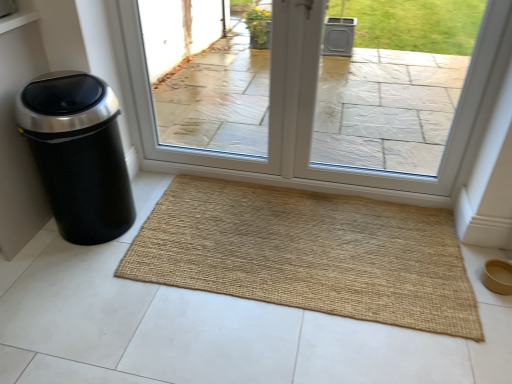
Where is `natural fiber mat at center`? The image size is (512, 384). natural fiber mat at center is located at coordinates (308, 253).

In order to face black matte trash can at left, should I rotate leftwards or rightwards?

Rotate your view left by about 21.879°.

Find the location of a particular element. This screenshot has width=512, height=384. natural fiber mat at center is located at coordinates (308, 253).

Is natural fiber mat at center to the left or to the right of black matte trash can at left in the image?

From the image, it's evident that natural fiber mat at center is to the right of black matte trash can at left.

Is natural fiber mat at center bigger than black matte trash can at left?

No, natural fiber mat at center is not bigger than black matte trash can at left.

How much distance is there between natural fiber mat at center and black matte trash can at left?

25.78 inches.

From a real-world perspective, is natural fiber mat at center above or below black matte trash can at left?

Clearly, from a real-world perspective, natural fiber mat at center is below black matte trash can at left.

Looking at this image, are black matte trash can at left and clear glass door at center far apart?

They are positioned close to each other.

Does point (123, 213) come farther from viewer compared to point (473, 69)?

Yes, point (123, 213) is behind point (473, 69).

From the image's perspective, is black matte trash can at left under clear glass door at center?

Indeed, from the image's perspective, black matte trash can at left is shown beneath clear glass door at center.

Based on their positions, is black matte trash can at left located to the left or right of clear glass door at center?

Based on their positions, black matte trash can at left is located to the left of clear glass door at center.

Looking at this image, from a real-world perspective, is natural fiber mat at center physically below clear glass door at center?

Yes, from a real-world perspective, natural fiber mat at center is below clear glass door at center.

Are natural fiber mat at center and clear glass door at center beside each other?

No, natural fiber mat at center is not making contact with clear glass door at center.

Based on the photo, which point is more forward, (172, 256) or (469, 111)?

Point (172, 256)

What's the angular difference between natural fiber mat at center and clear glass door at center's facing directions?

They differ by 0.579 degrees in their facing directions.

The width and height of the screenshot is (512, 384). Find the location of `window behind the black matte trash can at left`. window behind the black matte trash can at left is located at coordinates coord(314,105).

Can you confirm if clear glass door at center is positioned to the left of black matte trash can at left?

Incorrect, clear glass door at center is not on the left side of black matte trash can at left.

Considering the sizes of clear glass door at center and black matte trash can at left in the image, is clear glass door at center bigger or smaller than black matte trash can at left?

Considering their sizes, clear glass door at center takes up more space than black matte trash can at left.

Which object is further away from the camera taking this photo, clear glass door at center or black matte trash can at left?

clear glass door at center is further from the camera.

Is black matte trash can at left with natural fiber mat at center?

black matte trash can at left is not next to natural fiber mat at center, and they're not touching.

Is black matte trash can at left outside of natural fiber mat at center?

That's correct, black matte trash can at left is outside of natural fiber mat at center.

Which is nearer, (x=79, y=111) or (x=133, y=265)?

The point (x=79, y=111) is closer to the camera.

Could you tell me if clear glass door at center is facing natural fiber mat at center?

Yes.

Considering their positions, is clear glass door at center located in front of or behind natural fiber mat at center?

clear glass door at center is positioned farther from the viewer than natural fiber mat at center.

The width and height of the screenshot is (512, 384). I want to click on mat on the right of the clear glass door at center, so click(x=308, y=253).

Consider the image. From a real-world perspective, between clear glass door at center and natural fiber mat at center, who is vertically lower?

In real-world perspective, natural fiber mat at center is lower.

Identify the location of waste container on the left side of natural fiber mat at center. The image size is (512, 384). (78, 154).

Locate an element on the screen. This screenshot has height=384, width=512. window behind the black matte trash can at left is located at coordinates (314, 105).

Considering their positions, is black matte trash can at left positioned further to clear glass door at center than natural fiber mat at center?

Based on the image, black matte trash can at left appears to be further to clear glass door at center.

Looking at the image, which one is located closer to clear glass door at center, natural fiber mat at center or black matte trash can at left?

natural fiber mat at center.

Considering their positions, is black matte trash can at left positioned closer to natural fiber mat at center than clear glass door at center?

clear glass door at center is closer to natural fiber mat at center.

When comparing their distances from black matte trash can at left, does clear glass door at center or natural fiber mat at center seem closer?

Among the two, natural fiber mat at center is located nearer to black matte trash can at left.

Based on their spatial positions, is clear glass door at center or black matte trash can at left closer to natural fiber mat at center?

Based on the image, clear glass door at center appears to be nearer to natural fiber mat at center.

Estimate the real-world distances between objects in this image. Which object is further from black matte trash can at left, natural fiber mat at center or clear glass door at center?

The object further to black matte trash can at left is clear glass door at center.

Identify the location of window between black matte trash can at left and natural fiber mat at center from left to right. Image resolution: width=512 pixels, height=384 pixels. (314, 105).